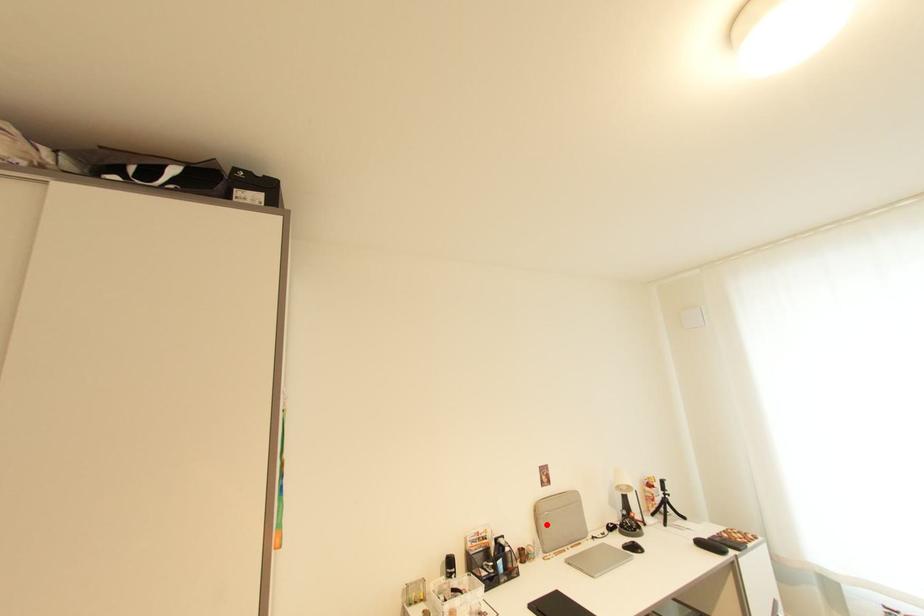
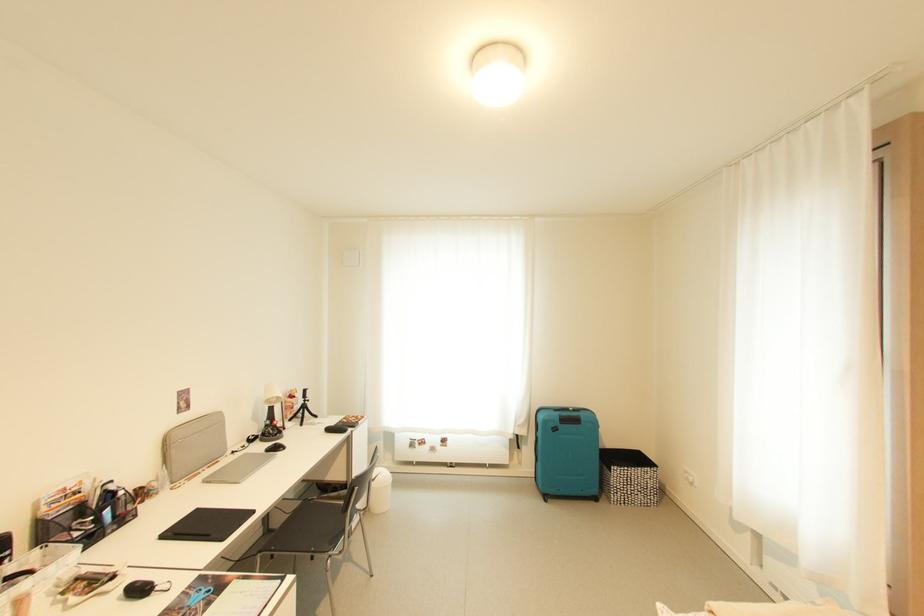
Question: I am providing you with two images of the same scene from different viewpoints. Image1 has a red point marked. In image2, the corresponding 3D location appears at what relative position? Reply with the corresponding letter.

Choices:
 (A) Closer
 (B) Farther

Answer: (A)